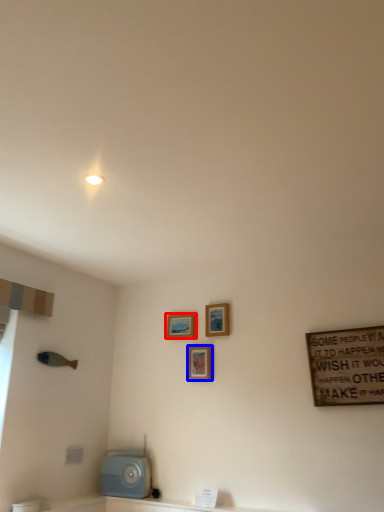
Question: Which object appears farthest to the camera in this image, picture frame (highlighted by a red box) or picture frame (highlighted by a blue box)?

Choices:
 (A) picture frame
 (B) picture frame

Answer: (A)